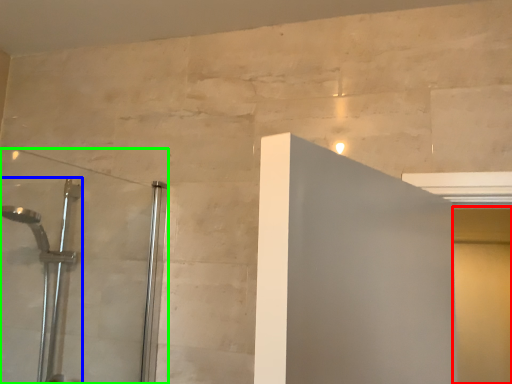
Question: Based on their relative distances, which object is farther from screen door (highlighted by a red box)? Choose from shower (highlighted by a blue box) and shower door (highlighted by a green box).

Choices:
 (A) shower
 (B) shower door

Answer: (A)